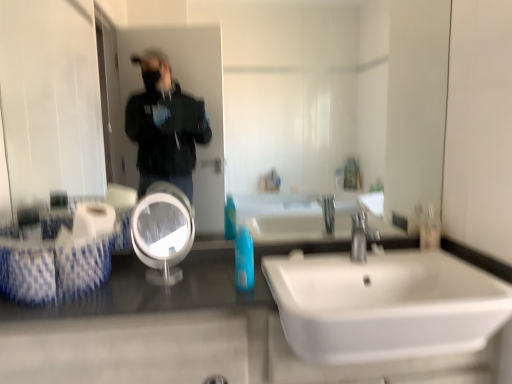
The image size is (512, 384). What are the coordinates of `free space between clear plastic bottle at right, which is counted as the 2th mouthwash, starting from the front, and satin nickel faucet at center` in the screenshot? It's located at (402, 252).